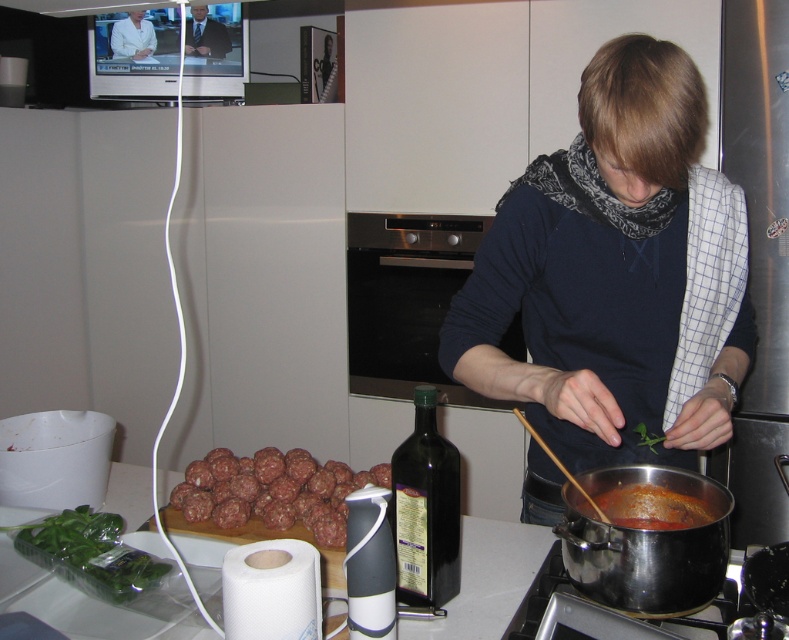
Question: Does dark blue sweater at center have a larger size compared to red matte sauce at lower center?

Choices:
 (A) yes
 (B) no

Answer: (A)

Question: Which is nearer to the white smooth coat at upper left?

Choices:
 (A) red matte sauce at lower center
 (B) brown meatballs at lower left
 (C) green glass bottle at center
 (D) stainless steel pot at lower right

Answer: (B)

Question: Which is farther from the white smooth coat at upper left?

Choices:
 (A) green leafy vegetable at lower left
 (B) stainless steel pot at lower center
 (C) green glass bottle at center

Answer: (B)

Question: Is brown meatballs at lower left above green leafy vegetable at lower left?

Choices:
 (A) yes
 (B) no

Answer: (A)

Question: Does green leafy vegetable at lower left lie in front of stainless steel pot at lower center?

Choices:
 (A) no
 (B) yes

Answer: (A)

Question: Which point is farther to the camera?

Choices:
 (A) stainless steel pot at lower right
 (B) green leafy vegetable at lower left
 (C) dark blue sweater at center
 (D) stainless steel pot at lower center

Answer: (B)